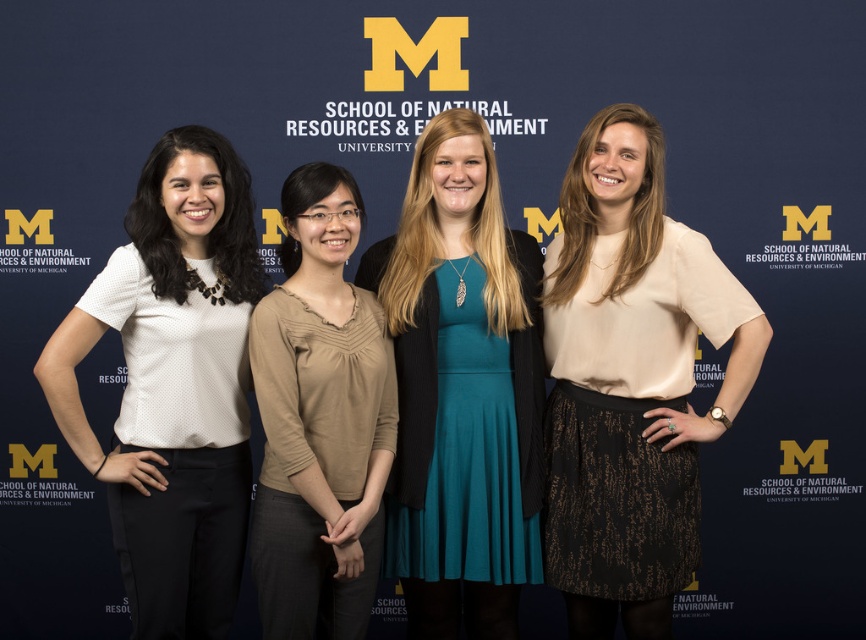
Looking at the two blouses, the matte beige blouse at center and the white dotted blouse at left, which one is positioned higher on the person wearing it?

The matte beige blouse at center is positioned higher than the white dotted blouse at left.